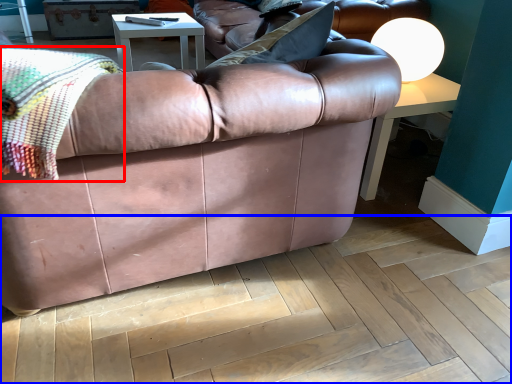
Question: Which point is further to the camera, blanket (highlighted by a red box) or plywood (highlighted by a blue box)?

Choices:
 (A) blanket
 (B) plywood

Answer: (B)